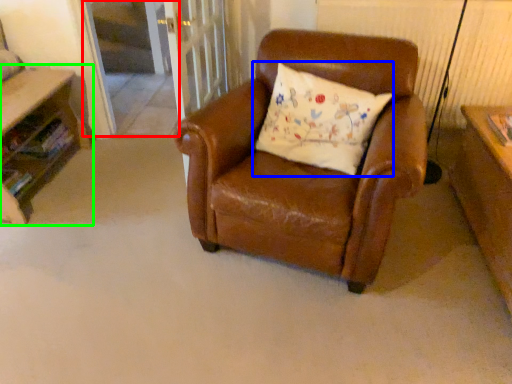
Question: Estimate the real-world distances between objects in this image. Which object is closer to screen door (highlighted by a red box), pillow (highlighted by a blue box) or table (highlighted by a green box)?

Choices:
 (A) pillow
 (B) table

Answer: (B)